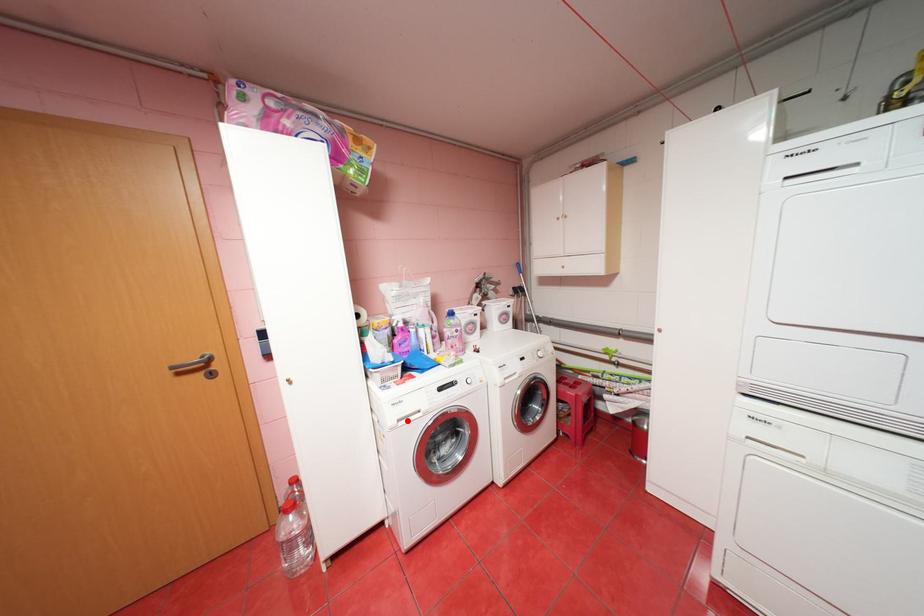
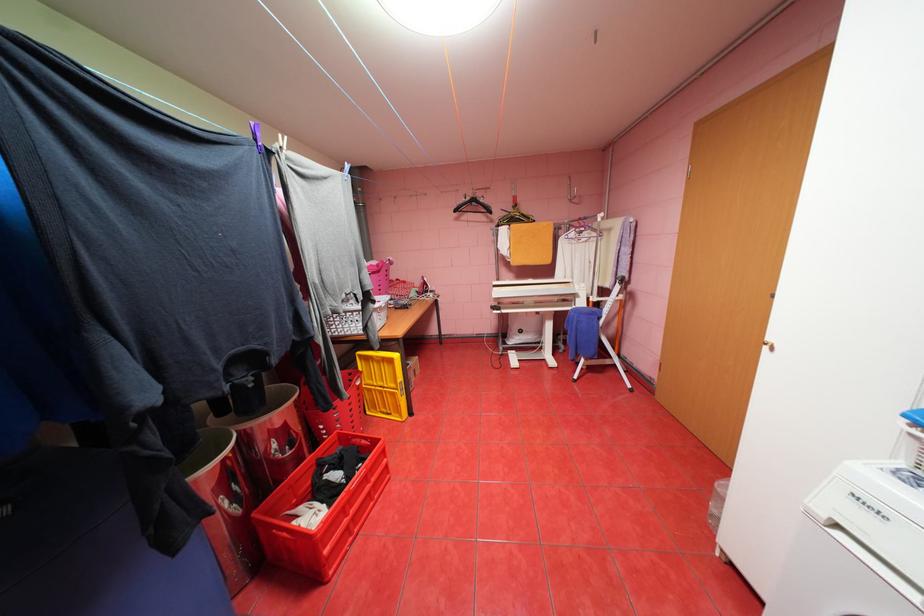
Find the pixel in the second image that matches the highlighted location in the first image.

(845, 525)